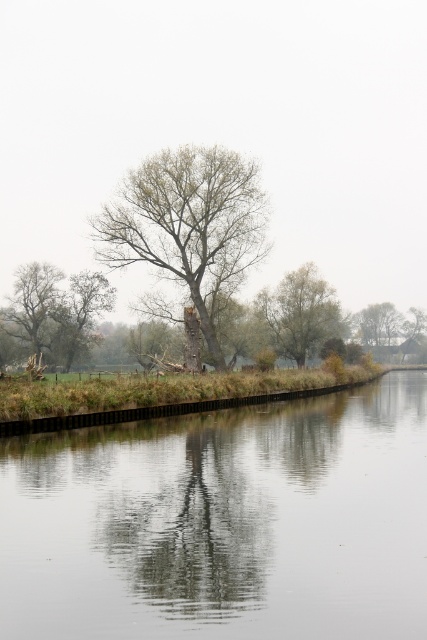
You are an environmental scientist observing the landscape. You notice two trees labeled as green leafy tree at center and green matte tree at center. Which tree would cast a larger shadow during midday when the sun is directly overhead?

The green leafy tree at center is bigger than the green matte tree at center, so it would cast a larger shadow during midday when the sun is directly overhead.

You are standing on the grassy bank and want to cross to the other side. The smooth concrete river at center and the green leafy tree at center are in your path. Which one do you need to navigate around first?

You need to navigate around the smooth concrete river at center first because it has a lesser height compared to the green leafy tree at center, making it closer to your current position on the grassy bank.

Based on the scene description, what can be found at the coordinate point labeled as point (189, 227)?

At point (189, 227) lies green leafy tree at center.